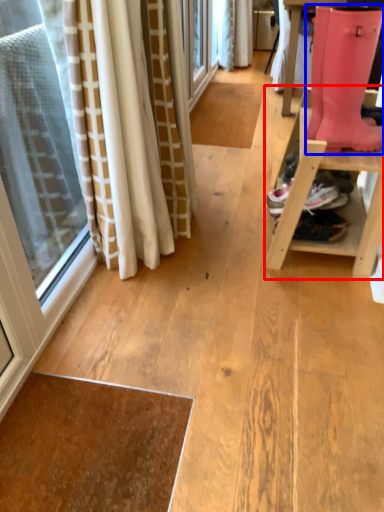
Question: Which point is further to the camera, furniture (highlighted by a red box) or footwear (highlighted by a blue box)?

Choices:
 (A) furniture
 (B) footwear

Answer: (A)